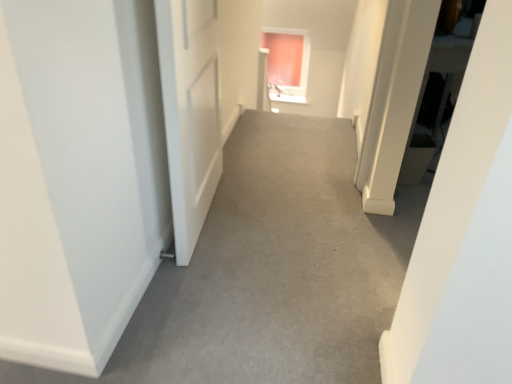
What do you see at coordinates (287, 63) in the screenshot?
I see `pink glass window at upper center` at bounding box center [287, 63].

Image resolution: width=512 pixels, height=384 pixels. What are the coordinates of `pink glass window at upper center` in the screenshot? It's located at (287, 63).

Describe the element at coordinates (277, 269) in the screenshot. This screenshot has height=384, width=512. I see `gray carpet at center` at that location.

Identify the location of gray carpet at center. The width and height of the screenshot is (512, 384). (277, 269).

Find the location of `pink glass window at upper center`. pink glass window at upper center is located at coordinates point(287,63).

Based on the photo, does gray carpet at center appear on the left side of pink glass window at upper center?

Yes, gray carpet at center is to the left of pink glass window at upper center.

Is gray carpet at center behind pink glass window at upper center?

No, the depth of gray carpet at center is less than that of pink glass window at upper center.

Which is nearer, [330,363] or [305,87]?

Clearly, point [330,363] is closer to the camera than point [305,87].

From the image's perspective, is gray carpet at center located above pink glass window at upper center?

No, from the image's perspective, gray carpet at center is not above pink glass window at upper center.

From a real-world perspective, does gray carpet at center sit lower than pink glass window at upper center?

Actually, gray carpet at center is physically above pink glass window at upper center in the real world.

Considering the relative sizes of gray carpet at center and pink glass window at upper center in the image provided, is gray carpet at center thinner than pink glass window at upper center?

No.

In the scene shown: Between gray carpet at center and pink glass window at upper center, which one has less height?

gray carpet at center is shorter.

Can you confirm if gray carpet at center is smaller than pink glass window at upper center?

No.

Do you think gray carpet at center is within pink glass window at upper center, or outside of it?

gray carpet at center is spatially situated outside pink glass window at upper center.

Is gray carpet at center beside pink glass window at upper center?

No, gray carpet at center is not with pink glass window at upper center.

Is gray carpet at center oriented towards pink glass window at upper center?

No, gray carpet at center is not aimed at pink glass window at upper center.

How many degrees apart are the facing directions of gray carpet at center and pink glass window at upper center?

91.4 degrees.

The image size is (512, 384). Identify the location of alley in front of the pink glass window at upper center. (277, 269).

Which is more to the left, pink glass window at upper center or gray carpet at center?

gray carpet at center is more to the left.

In the scene shown: Is pink glass window at upper center closer to camera compared to gray carpet at center?

No.

Considering the points (296, 83) and (350, 377), which point is behind, point (296, 83) or point (350, 377)?

The point (296, 83) is farther.

From the image's perspective, is pink glass window at upper center under gray carpet at center?

No, from the image's perspective, pink glass window at upper center is not beneath gray carpet at center.

From a real-world perspective, is pink glass window at upper center positioned over gray carpet at center based on gravity?

No, from a real-world perspective, pink glass window at upper center is not above gray carpet at center.

Can you confirm if pink glass window at upper center is thinner than gray carpet at center?

Yes, pink glass window at upper center is thinner than gray carpet at center.

Considering the sizes of pink glass window at upper center and gray carpet at center in the image, is pink glass window at upper center taller or shorter than gray carpet at center?

pink glass window at upper center is taller than gray carpet at center.

Does pink glass window at upper center have a smaller size compared to gray carpet at center?

Indeed, pink glass window at upper center has a smaller size compared to gray carpet at center.

Can we say pink glass window at upper center lies outside gray carpet at center?

Indeed, pink glass window at upper center is completely outside gray carpet at center.

Is pink glass window at upper center with gray carpet at center?

No, pink glass window at upper center is not in contact with gray carpet at center.

Could you tell me if pink glass window at upper center is facing gray carpet at center?

Yes.

Can you tell me how much pink glass window at upper center and gray carpet at center differ in facing direction?

They differ by 91.4 degrees in their facing directions.

Locate an element on the screen. alley in front of the pink glass window at upper center is located at coordinates (277, 269).

Identify the location of alley lying in front of the pink glass window at upper center. The image size is (512, 384). (277, 269).

Locate an element on the screen. Image resolution: width=512 pixels, height=384 pixels. alley below the pink glass window at upper center (from the image's perspective) is located at coordinates (277, 269).